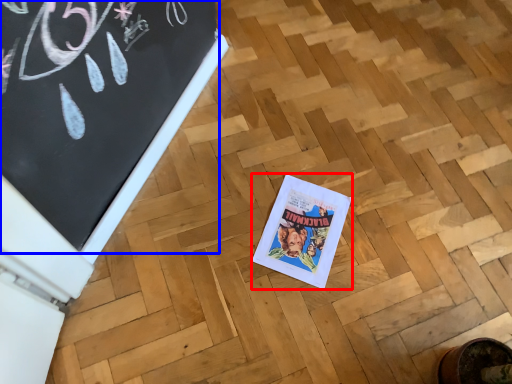
Question: Among these objects, which one is nearest to the camera, comic book (highlighted by a red box) or bulletin board (highlighted by a blue box)?

Choices:
 (A) comic book
 (B) bulletin board

Answer: (B)